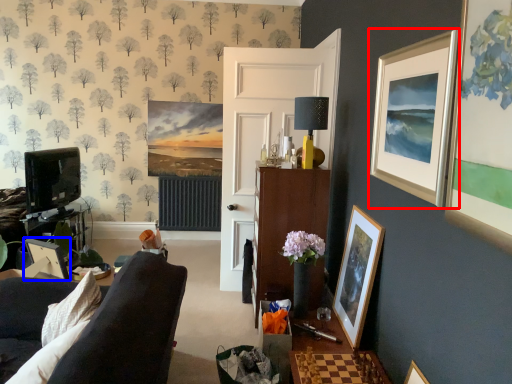
Question: Which point is closer to the camera, picture frame (highlighted by a red box) or picture frame (highlighted by a blue box)?

Choices:
 (A) picture frame
 (B) picture frame

Answer: (A)